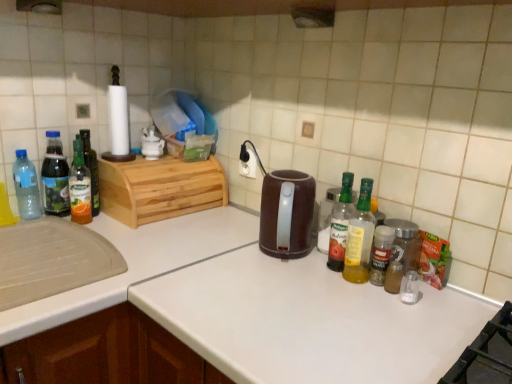
The width and height of the screenshot is (512, 384). I want to click on free space above brown plastic kettle at center (from a real-world perspective), so (x=291, y=176).